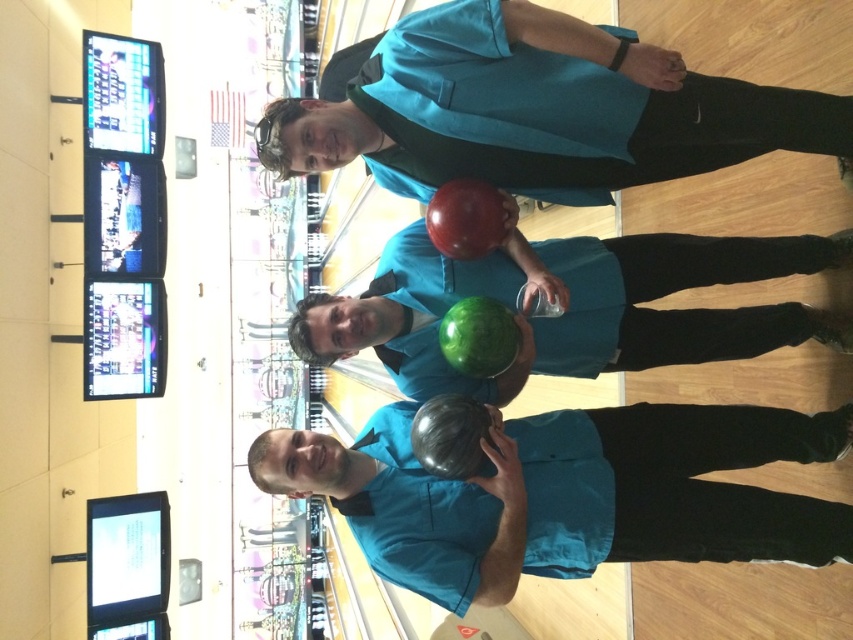
Based on the photo, you are a bowling ball storage robot that needs to place both the matte black bowling ball at center and the shiny green bowling ball at center into a storage compartment that can only fit one bowling ball at a time. Based on their sizes, which one should you place first?

The matte black bowling ball at center might be wider than the shiny green bowling ball at center, so you should place the matte black bowling ball at center first to ensure it fits properly.

You are a photographer at the bowling alley and need to capture a closeup shot of the matte black bowling ball at center and the matte teal bowling ball at upper center. Since you can only focus on one ball at a time, which ball should you choose to ensure the other is still in focus if they are aligned along the same depth plane?

The matte black bowling ball at center is smaller than the matte teal bowling ball at upper center, so focusing on the larger matte teal bowling ball at upper center would keep the smaller matte black bowling ball at center in focus due to its proximity in size and alignment along the same depth plane.